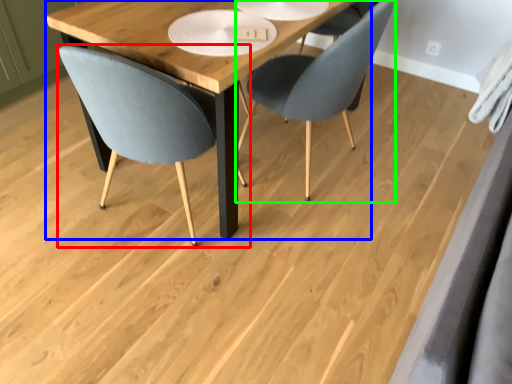
Question: Considering the real-world distances, which object is closest to chair (highlighted by a red box)? table (highlighted by a blue box) or chair (highlighted by a green box).

Choices:
 (A) table
 (B) chair

Answer: (A)